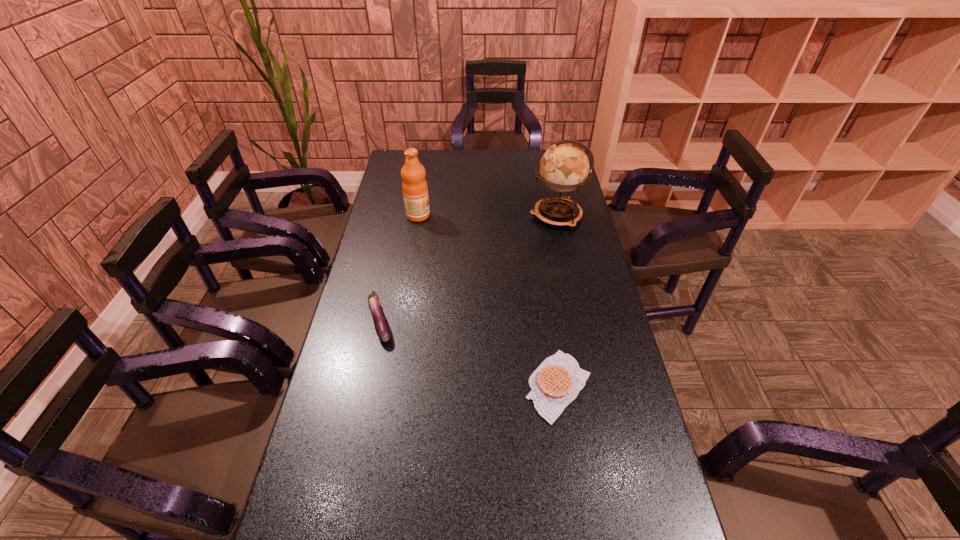
Find the location of `the tallest object`. the tallest object is located at coordinates (564, 167).

The image size is (960, 540). Find the location of `fruit juice`. fruit juice is located at coordinates (415, 190).

Where is `the third tallest object`? the third tallest object is located at coordinates (381, 325).

The image size is (960, 540). I want to click on eggplant, so click(x=381, y=325).

Where is `pie`? This screenshot has width=960, height=540. pie is located at coordinates (557, 381).

Find the location of a particular element. The height and width of the screenshot is (540, 960). the shortest object is located at coordinates (557, 381).

Find the location of a particular element. vacant space located 0.230m at the center of the globe is located at coordinates 472,215.

Locate an element on the screen. Image resolution: width=960 pixels, height=540 pixels. vacant space located at the center of the globe is located at coordinates (500, 215).

This screenshot has height=540, width=960. I want to click on free spot located at the center of the globe, so click(515, 215).

This screenshot has width=960, height=540. I want to click on vacant region located 0.140m on the label side of the second tallest object, so click(465, 215).